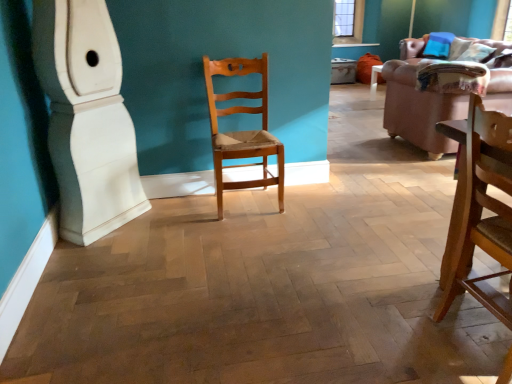
Question: Does velvet pink couch at right contain light brown wood chair at center, the 1th chair from the back?

Choices:
 (A) no
 (B) yes

Answer: (A)

Question: Considering the relative sizes of velvet pink couch at right and light brown wood chair at center, positioned as the second chair in front-to-back order, in the image provided, is velvet pink couch at right bigger than light brown wood chair at center, positioned as the second chair in front-to-back order,?

Choices:
 (A) yes
 (B) no

Answer: (A)

Question: From a real-world perspective, is velvet pink couch at right positioned over light brown wood chair at center, positioned as the second chair in front-to-back order, based on gravity?

Choices:
 (A) no
 (B) yes

Answer: (A)

Question: From the image's perspective, is velvet pink couch at right over light brown wood chair at center, the 1th chair from the back?

Choices:
 (A) no
 (B) yes

Answer: (B)

Question: Is velvet pink couch at right aimed at light brown wood chair at center, the second chair viewed from the right?

Choices:
 (A) yes
 (B) no

Answer: (B)

Question: Would you consider velvet pink couch at right to be distant from light brown wood chair at center, which ranks as the 1th chair in left-to-right order?

Choices:
 (A) yes
 (B) no

Answer: (A)

Question: Considering the relative sizes of light brown wood chair at center, the 1th chair from the back, and velvet pink couch at right in the image provided, is light brown wood chair at center, the 1th chair from the back, thinner than velvet pink couch at right?

Choices:
 (A) no
 (B) yes

Answer: (B)

Question: Is light brown wood chair at center, the second chair viewed from the right, smaller than velvet pink couch at right?

Choices:
 (A) no
 (B) yes

Answer: (B)

Question: Is light brown wood chair at center, the second chair viewed from the right, positioned behind velvet pink couch at right?

Choices:
 (A) no
 (B) yes

Answer: (A)

Question: From a real-world perspective, does light brown wood chair at center, the second chair viewed from the right, sit lower than velvet pink couch at right?

Choices:
 (A) no
 (B) yes

Answer: (A)

Question: Can you confirm if light brown wood chair at center, the 1th chair from the back, is shorter than velvet pink couch at right?

Choices:
 (A) yes
 (B) no

Answer: (B)

Question: Are light brown wood chair at center, the second chair viewed from the right, and velvet pink couch at right beside each other?

Choices:
 (A) no
 (B) yes

Answer: (A)

Question: Are brown leather couch at upper right and light brown wood chair at center, the 1th chair from the back, located far from each other?

Choices:
 (A) yes
 (B) no

Answer: (A)